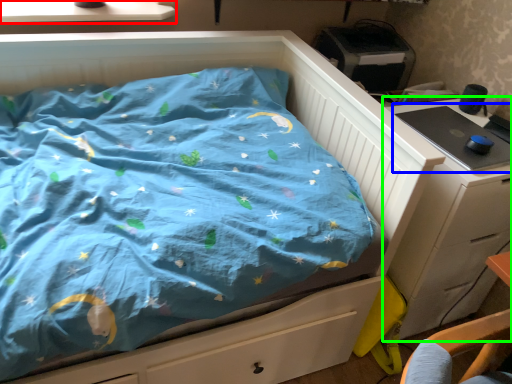
Question: Considering the real-world distances, which object is closest to window sill (highlighted by a red box)? desktop (highlighted by a blue box) or chest of drawers (highlighted by a green box).

Choices:
 (A) desktop
 (B) chest of drawers

Answer: (A)